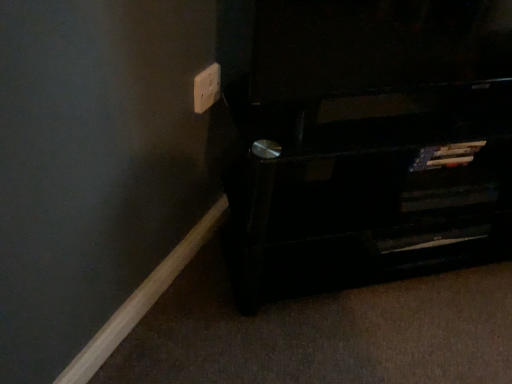
Where is `black wood shelf at lower right`? black wood shelf at lower right is located at coordinates (369, 143).

The width and height of the screenshot is (512, 384). What do you see at coordinates (369, 143) in the screenshot?
I see `black wood shelf at lower right` at bounding box center [369, 143].

Identify the location of white plastic electric outlet at upper center. 207,88.

The width and height of the screenshot is (512, 384). What do you see at coordinates (207, 88) in the screenshot?
I see `white plastic electric outlet at upper center` at bounding box center [207, 88].

Locate an element on the screen. The width and height of the screenshot is (512, 384). black wood shelf at lower right is located at coordinates (369, 143).

Is black wood shelf at lower right at the left side of white plastic electric outlet at upper center?

No, black wood shelf at lower right is not to the left of white plastic electric outlet at upper center.

Which is in front, black wood shelf at lower right or white plastic electric outlet at upper center?

black wood shelf at lower right is closer to the camera.

Is point (408, 177) farther from camera compared to point (214, 72)?

That is True.

From the image's perspective, would you say black wood shelf at lower right is positioned over white plastic electric outlet at upper center?

No.

From a real-world perspective, who is located lower, black wood shelf at lower right or white plastic electric outlet at upper center?

black wood shelf at lower right, from a real-world perspective.

Considering the relative sizes of black wood shelf at lower right and white plastic electric outlet at upper center in the image provided, is black wood shelf at lower right wider than white plastic electric outlet at upper center?

Yes.

Does black wood shelf at lower right have a lesser height compared to white plastic electric outlet at upper center?

In fact, black wood shelf at lower right may be taller than white plastic electric outlet at upper center.

Looking at the image, does black wood shelf at lower right seem bigger or smaller compared to white plastic electric outlet at upper center?

Clearly, black wood shelf at lower right is larger in size than white plastic electric outlet at upper center.

Is black wood shelf at lower right situated inside white plastic electric outlet at upper center or outside?

black wood shelf at lower right exists outside the volume of white plastic electric outlet at upper center.

Are black wood shelf at lower right and white plastic electric outlet at upper center far apart?

black wood shelf at lower right is actually quite close to white plastic electric outlet at upper center.

Is white plastic electric outlet at upper center at the back of black wood shelf at lower right?

black wood shelf at lower right is not turned away from white plastic electric outlet at upper center.

In the scene shown: How different are the orientations of black wood shelf at lower right and white plastic electric outlet at upper center in degrees?

47.6 degrees separate the facing orientations of black wood shelf at lower right and white plastic electric outlet at upper center.

Measure the distance from black wood shelf at lower right to white plastic electric outlet at upper center.

The distance of black wood shelf at lower right from white plastic electric outlet at upper center is 42.70 centimeters.

The height and width of the screenshot is (384, 512). In order to click on furniture below the white plastic electric outlet at upper center (from the image's perspective) in this screenshot , I will do `click(369, 143)`.

Which object is positioned more to the left, white plastic electric outlet at upper center or black wood shelf at lower right?

white plastic electric outlet at upper center.

In the image, is white plastic electric outlet at upper center positioned in front of or behind black wood shelf at lower right?

Visually, white plastic electric outlet at upper center is located behind black wood shelf at lower right.

Is point (209, 67) positioned after point (296, 247)?

No, it is in front of (296, 247).

From the picture: From the image's perspective, which one is positioned lower, white plastic electric outlet at upper center or black wood shelf at lower right?

From the image's view, black wood shelf at lower right is below.

From a real-world perspective, is white plastic electric outlet at upper center physically above black wood shelf at lower right?

Yes, from a real-world perspective, white plastic electric outlet at upper center is on top of black wood shelf at lower right.

Does white plastic electric outlet at upper center have a greater width compared to black wood shelf at lower right?

Incorrect, the width of white plastic electric outlet at upper center does not surpass that of black wood shelf at lower right.

Which of these two, white plastic electric outlet at upper center or black wood shelf at lower right, stands shorter?

white plastic electric outlet at upper center.

Considering the relative sizes of white plastic electric outlet at upper center and black wood shelf at lower right in the image provided, is white plastic electric outlet at upper center bigger than black wood shelf at lower right?

No, white plastic electric outlet at upper center is not bigger than black wood shelf at lower right.

Is white plastic electric outlet at upper center situated inside black wood shelf at lower right or outside?

white plastic electric outlet at upper center is located beyond the bounds of black wood shelf at lower right.

Is white plastic electric outlet at upper center next to black wood shelf at lower right and touching it?

white plastic electric outlet at upper center and black wood shelf at lower right are clearly separated.

In the scene shown: Is white plastic electric outlet at upper center oriented towards black wood shelf at lower right?

Yes, white plastic electric outlet at upper center is facing black wood shelf at lower right.

Find the location of `furniture in front of the white plastic electric outlet at upper center`. furniture in front of the white plastic electric outlet at upper center is located at coordinates click(369, 143).

Find the location of a particular element. electric outlet above the black wood shelf at lower right (from the image's perspective) is located at coordinates (207, 88).

Locate an element on the screen. Image resolution: width=512 pixels, height=384 pixels. electric outlet positioned vertically above the black wood shelf at lower right (from a real-world perspective) is located at coordinates (207, 88).